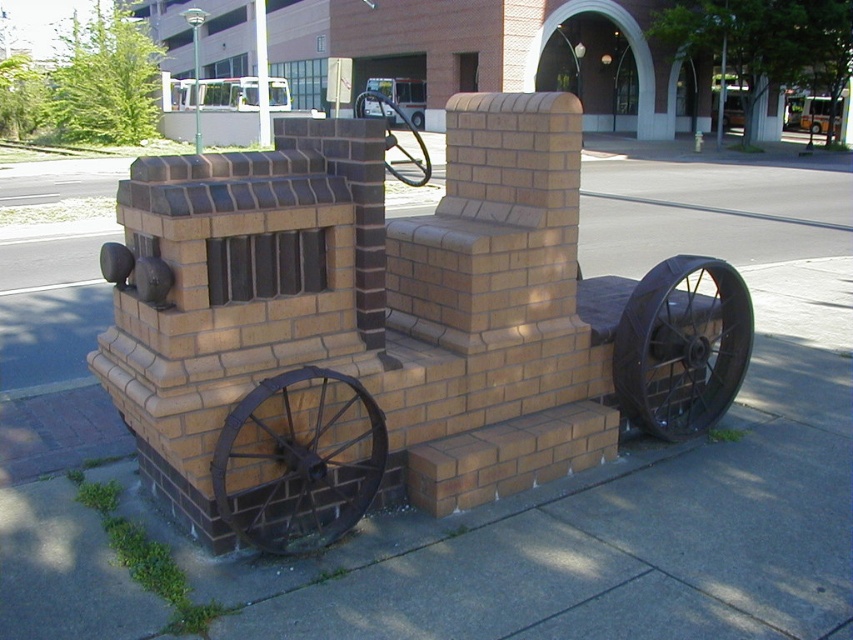
Question: Where is black metal/wrought iron wheel at lower left located in relation to black metal/wrought iron wheel at lower right in the image?

Choices:
 (A) right
 (B) left

Answer: (B)

Question: Estimate the real-world distances between objects in this image. Which object is farther from the black rubber tire at center?

Choices:
 (A) black metal/wrought iron wheel at lower right
 (B) black metal/wrought iron wheel at lower left

Answer: (B)

Question: Among these objects, which one is farthest from the camera?

Choices:
 (A) black rubber tire at center
 (B) black metal/wrought iron wheel at lower left
 (C) black metal/wrought iron wheel at lower right

Answer: (A)

Question: Does black metal/wrought iron wheel at lower right appear on the right side of black rubber tire at center?

Choices:
 (A) no
 (B) yes

Answer: (B)

Question: Which point is farther to the camera?

Choices:
 (A) (723, 410)
 (B) (415, 125)
 (C) (312, 509)

Answer: (B)

Question: In this image, where is black metal/wrought iron wheel at lower right located relative to rustic metal wheel at center?

Choices:
 (A) left
 (B) right

Answer: (B)